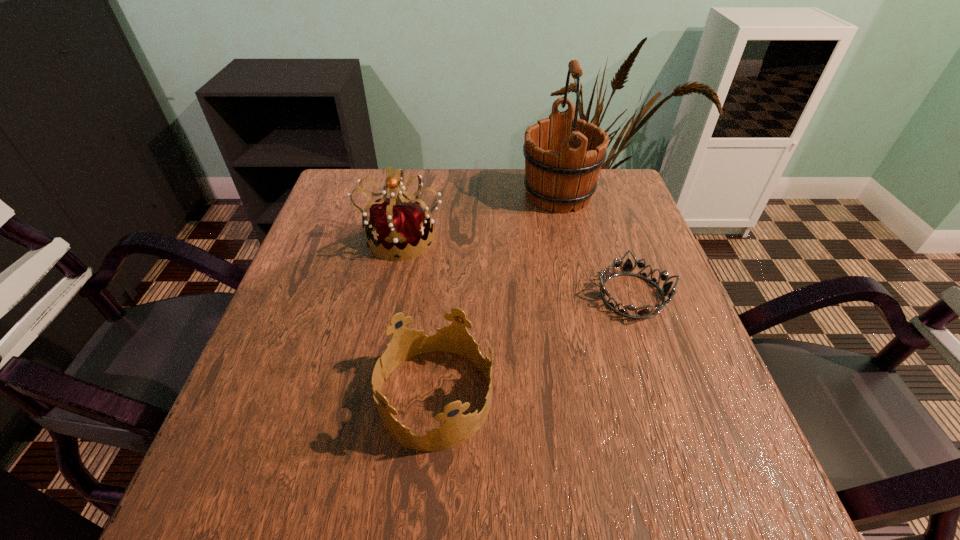
Identify the location of vacant area situated on the front-facing side of the rightmost tiara. (690, 462).

Identify the location of wine bucket at the far edge. (563, 158).

Where is `tiara located at the far edge`? The width and height of the screenshot is (960, 540). tiara located at the far edge is located at coordinates (397, 223).

Find the location of a particular element. The height and width of the screenshot is (540, 960). object located in the left edge section of the desktop is located at coordinates (397, 223).

The width and height of the screenshot is (960, 540). What are the coordinates of `wine bucket located in the right edge section of the desktop` in the screenshot? It's located at (563, 158).

You are a GUI agent. You are given a task and a screenshot of the screen. Output one action in this format:
    pyautogui.click(x=<x>, y=<y>)
    Task: Click on the tiara present at the right edge
    This screenshot has height=540, width=960.
    Given the screenshot: What is the action you would take?
    pyautogui.click(x=627, y=268)

Identify the location of object located at the far left corner. The height and width of the screenshot is (540, 960). (397, 223).

Image resolution: width=960 pixels, height=540 pixels. In order to click on object present at the far right corner in this screenshot , I will do click(x=563, y=158).

The image size is (960, 540). I want to click on vacant space at the far edge, so click(x=450, y=173).

Image resolution: width=960 pixels, height=540 pixels. In order to click on free space at the near edge in this screenshot , I will do `click(336, 485)`.